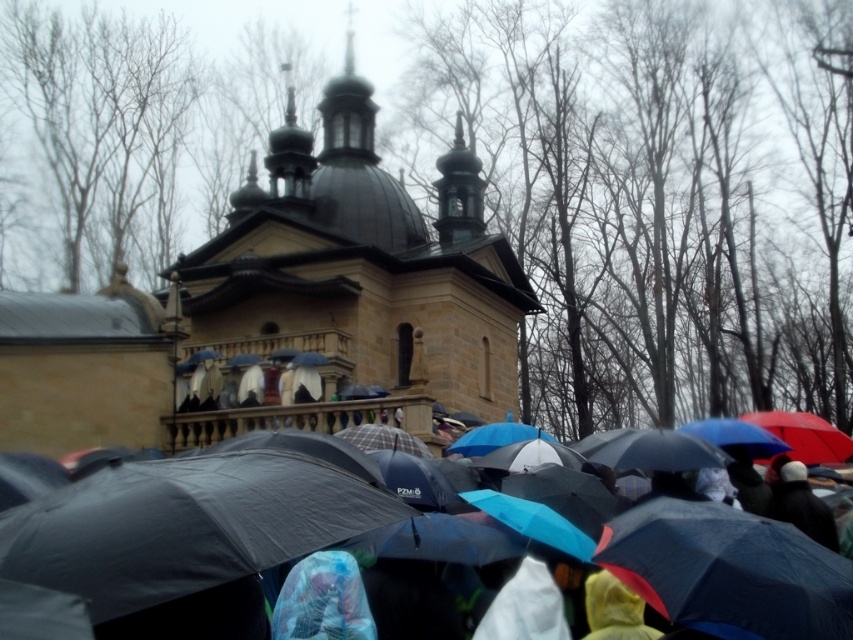
Which is behind, point (502, 310) or point (844, 602)?

The point (502, 310) is behind.

Between point (79, 436) and point (154, 486), which one is positioned in front?

Point (154, 486) is in front.

Where is `brown stone church at center`? Image resolution: width=853 pixels, height=640 pixels. brown stone church at center is located at coordinates (285, 296).